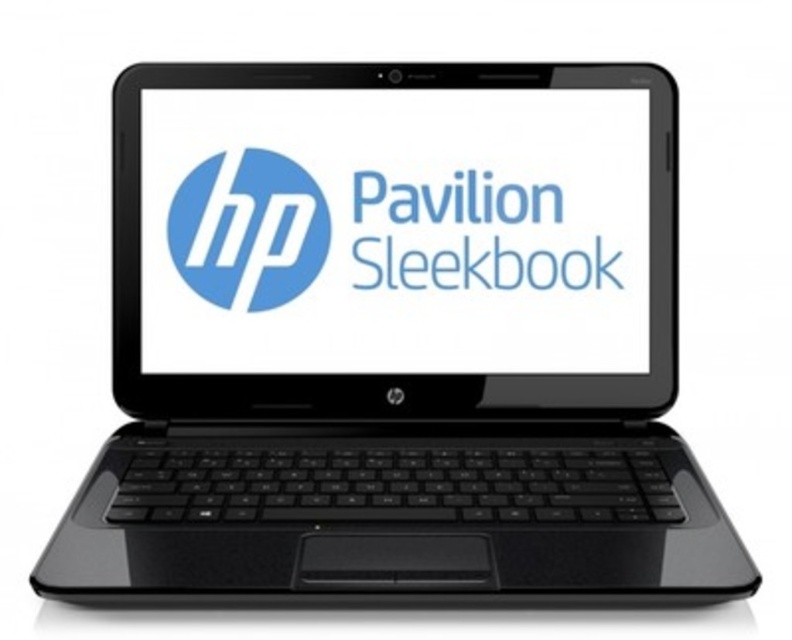
You are a graphic designer working on a project that requires precise alignment of elements. You need to place a new element exactly at the center of the laptop. Where should you position it relative to the matte black screen at center?

The matte black screen at center is already positioned at the center coordinates of the laptop, so placing the new element at the same point would ensure it is centered.

You are a photographer setting up a product shoot for the HP Pavilion Sleekbook laptop. You need to position a camera so that it captures the matte black screen at center clearly. Given that the camera must be placed 55.12 centimeters away from the screen to avoid glare, what is the minimum distance the camera should be from the edge of the laptop?

The matte black screen at center and camera are 55.12 centimeters apart, so the camera should be placed at least 55.12 centimeters away from the edge of the laptop to avoid glare.

You are a graphic designer working on a project that requires precise alignment. You need to place a matte blue circle exactly at the center of the HP Pavilion Sleekbook laptop displayed in the image. Can you confirm if the point at coordinates point (248, 228) is the correct location for the center of the matte blue circle?

Yes, the point at coordinates point (248, 228) is the correct location for the center of the matte blue circle as it lies at the center of the HP Pavilion Sleekbook laptop.